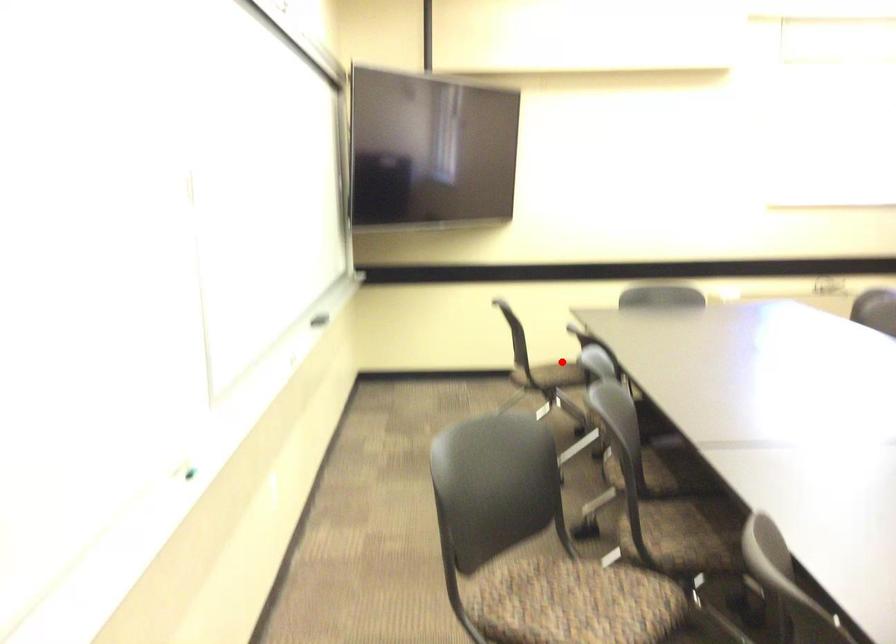
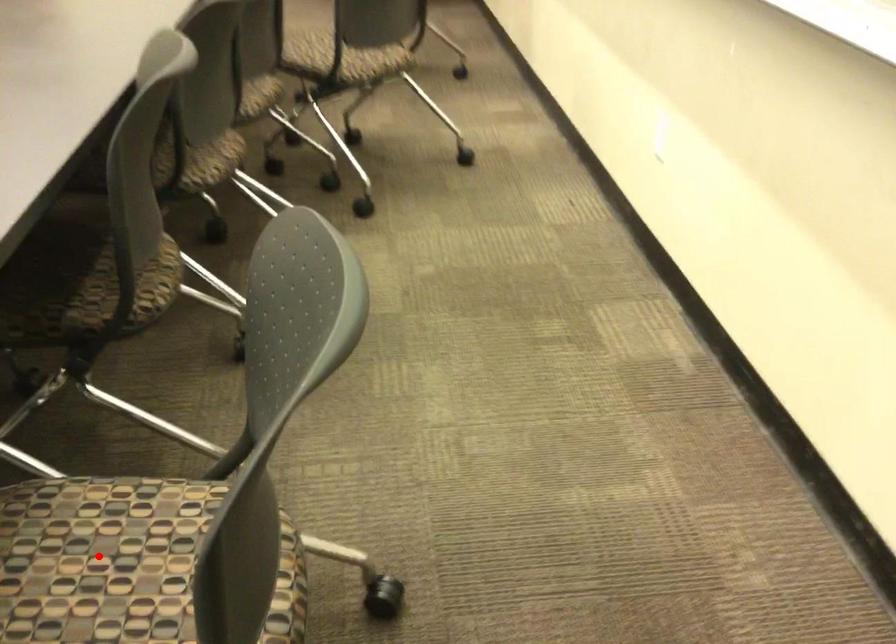
I am providing you with two images of the same scene from different viewpoints. A red point is marked on the first image and another point is marked on the second image. Do the highlighted points in image1 and image2 indicate the same real-world spot?

Yes